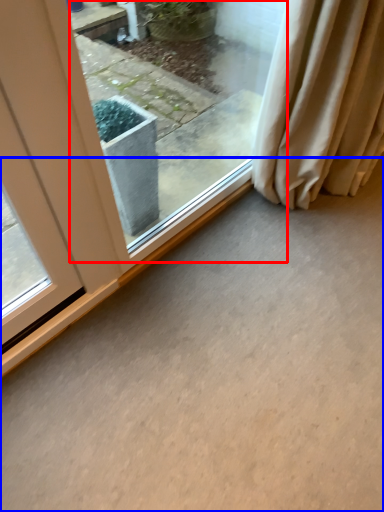
Question: Which of the following is the closest to the observer, window (highlighted by a red box) or concrete (highlighted by a blue box)?

Choices:
 (A) window
 (B) concrete

Answer: (B)